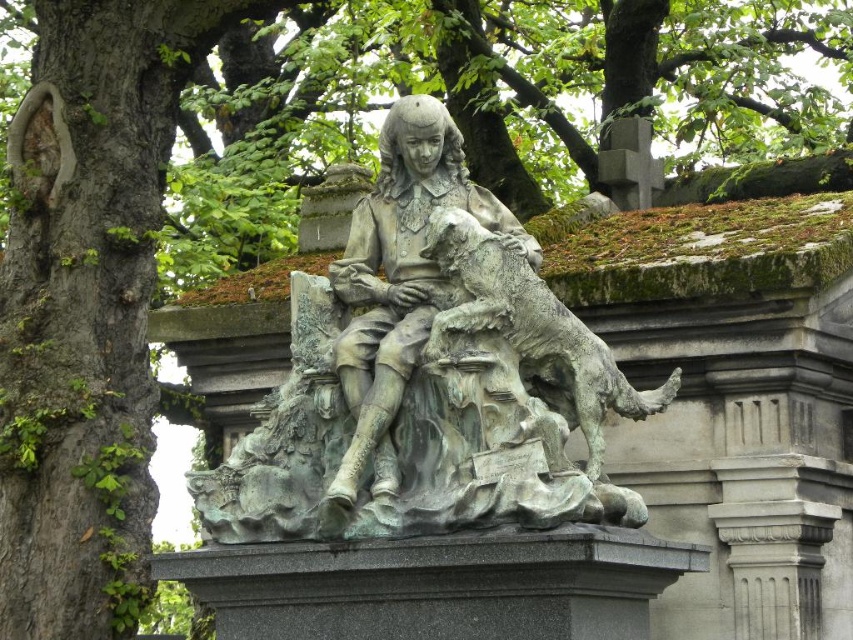
Question: Which point is farther to the camera?

Choices:
 (A) (351, 280)
 (B) (384, 426)

Answer: (A)

Question: Is green patinated bronze statue at center to the left of bronze statue at center from the viewer's perspective?

Choices:
 (A) no
 (B) yes

Answer: (B)

Question: Among these points, which one is farthest from the camera?

Choices:
 (A) (358, 404)
 (B) (250, 515)

Answer: (A)

Question: Is green patinated bronze statue at center smaller than bronze statue at center?

Choices:
 (A) no
 (B) yes

Answer: (A)

Question: Does green patinated bronze statue at center appear over bronze statue at center?

Choices:
 (A) yes
 (B) no

Answer: (B)

Question: Which of the following is the farthest from the observer?

Choices:
 (A) (428, 209)
 (B) (416, 132)

Answer: (A)